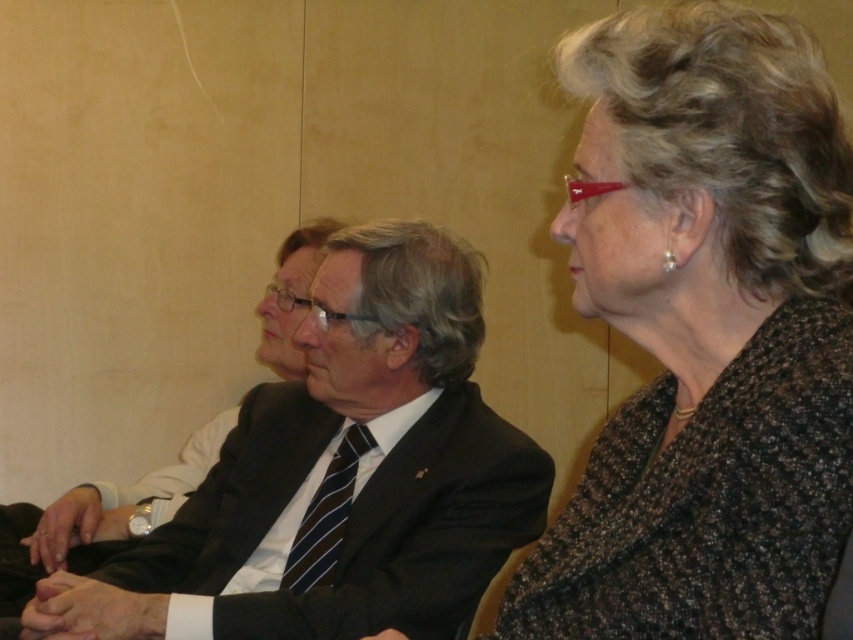
Who is more distant from viewer, (608, 520) or (126, 593)?

Positioned behind is point (126, 593).

I want to click on speckled woolen sweater at right, so click(706, 333).

Does dark suit at center appear over smooth skin hands at center?

Yes.

Who is more distant from viewer, (311, 576) or (73, 616)?

The point (311, 576) is behind.

Which is behind, point (379, 490) or point (136, 614)?

Point (379, 490)

Locate an element on the screen. Image resolution: width=853 pixels, height=640 pixels. dark suit at center is located at coordinates (357, 467).

Does point (744, 413) come closer to viewer compared to point (277, 512)?

That is True.

Does speckled woolen sweater at right lie behind dark suit at center?

No.

Is point (781, 67) more distant than point (310, 426)?

No.

Where is `speckled woolen sweater at right`? The width and height of the screenshot is (853, 640). speckled woolen sweater at right is located at coordinates (706, 333).